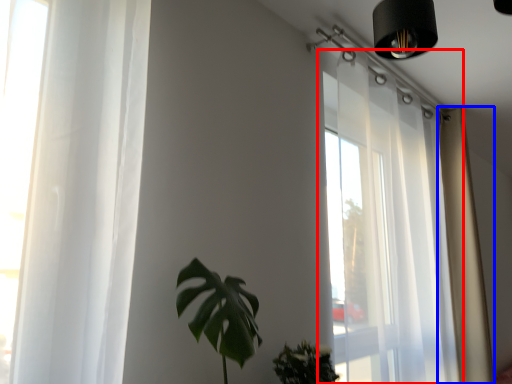
Question: Among these objects, which one is nearest to the camera, window (highlighted by a red box) or curtain (highlighted by a blue box)?

Choices:
 (A) window
 (B) curtain

Answer: (A)